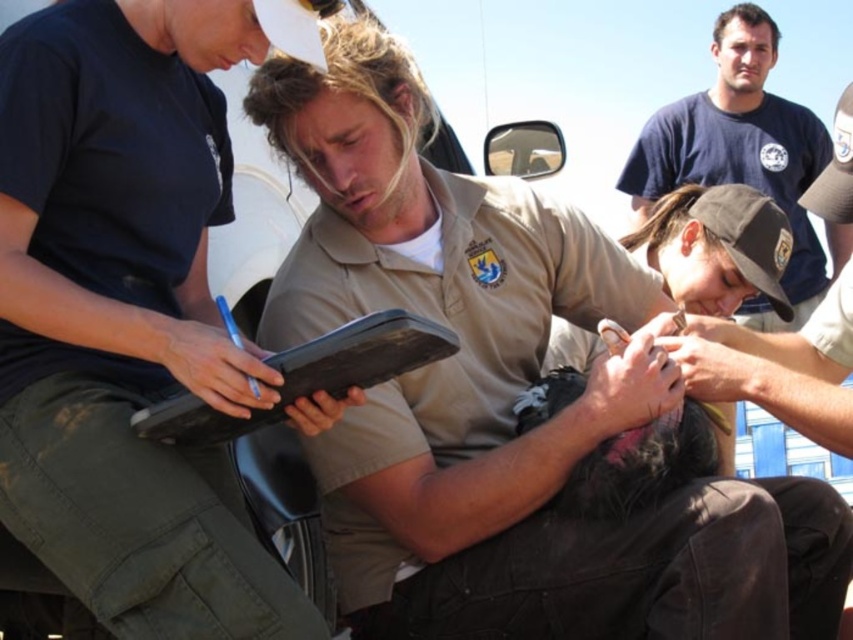
Question: Which object is positioned farthest from the matte khaki shirt at center?

Choices:
 (A) dark blue t-shirt at upper center
 (B) black matte clipboard at center

Answer: (A)

Question: Which point is farther from the camera taking this photo?

Choices:
 (A) (186, 417)
 (B) (767, 324)
 (C) (154, 92)

Answer: (B)

Question: Estimate the real-world distances between objects in this image. Which object is farther from the dark blue t-shirt at upper center?

Choices:
 (A) black matte clipboard at center
 (B) matte khaki shirt at center

Answer: (B)

Question: Can you confirm if matte khaki shirt at center is positioned to the left of black matte clipboard at center?

Choices:
 (A) yes
 (B) no

Answer: (A)

Question: Where is matte khaki shirt at center located in relation to black matte clipboard at center in the image?

Choices:
 (A) below
 (B) above

Answer: (B)

Question: Is matte khaki shirt at center above black matte clipboard at center?

Choices:
 (A) yes
 (B) no

Answer: (A)